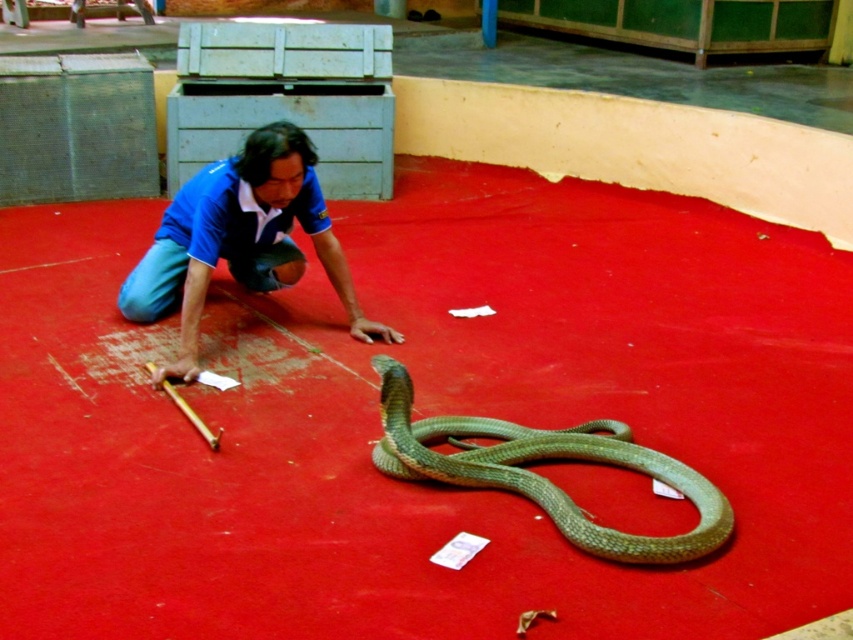
Does blue cotton shirt at center come in front of green scaly snake at center?

No, it is behind green scaly snake at center.

Image resolution: width=853 pixels, height=640 pixels. What are the coordinates of `blue cotton shirt at center` in the screenshot? It's located at (241, 240).

Which is in front, point (248, 257) or point (502, 452)?

Point (502, 452) is more forward.

Locate an element on the screen. blue cotton shirt at center is located at coordinates [241, 240].